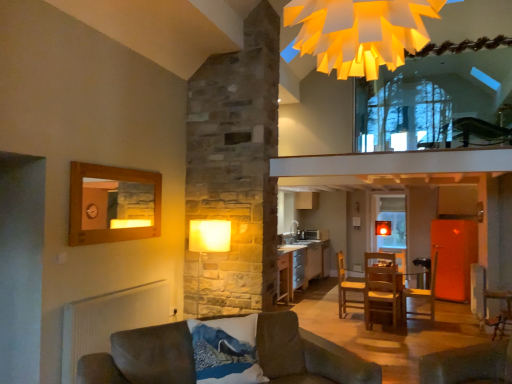
Question: Does wooden table at center appear on the right side of silver metallic cabinet at center?

Choices:
 (A) no
 (B) yes

Answer: (B)

Question: Is wooden table at center outside of silver metallic cabinet at center?

Choices:
 (A) yes
 (B) no

Answer: (A)

Question: Would you say silver metallic cabinet at center is part of wooden table at center's contents?

Choices:
 (A) yes
 (B) no

Answer: (B)

Question: Is wooden table at center thinner than silver metallic cabinet at center?

Choices:
 (A) no
 (B) yes

Answer: (A)

Question: Does wooden table at center have a larger size compared to silver metallic cabinet at center?

Choices:
 (A) no
 (B) yes

Answer: (B)

Question: Could you tell me if wooden table at center is facing silver metallic cabinet at center?

Choices:
 (A) yes
 (B) no

Answer: (B)

Question: Can you confirm if blue textured pillow at lower center is positioned to the right of wooden table at center?

Choices:
 (A) yes
 (B) no

Answer: (B)

Question: Is blue textured pillow at lower center positioned beyond the bounds of wooden table at center?

Choices:
 (A) yes
 (B) no

Answer: (A)

Question: Considering the relative sizes of blue textured pillow at lower center and wooden table at center in the image provided, is blue textured pillow at lower center bigger than wooden table at center?

Choices:
 (A) no
 (B) yes

Answer: (A)

Question: Does blue textured pillow at lower center have a greater height compared to wooden table at center?

Choices:
 (A) no
 (B) yes

Answer: (A)

Question: Would you say wooden table at center is part of blue textured pillow at lower center's contents?

Choices:
 (A) no
 (B) yes

Answer: (A)

Question: Is blue textured pillow at lower center aimed at wooden table at center?

Choices:
 (A) yes
 (B) no

Answer: (B)

Question: Would you say yellow paper chandelier at upper center is a long distance from velvet brown armchair at lower right, placed as the first armchair when sorted from front to back?

Choices:
 (A) yes
 (B) no

Answer: (A)